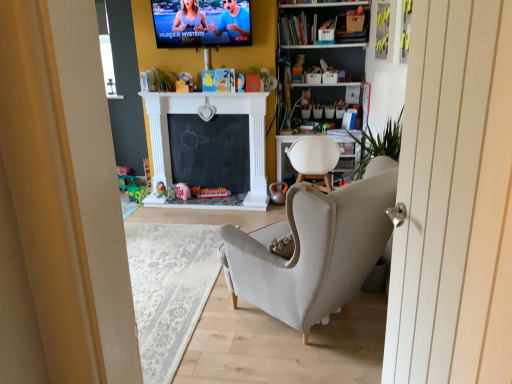
Question: Is white fabric chair at center to the left or to the right of matte pink piggy bank at center, the fourth toy viewed from the left, in the image?

Choices:
 (A) left
 (B) right

Answer: (B)

Question: From a real-world perspective, is white fabric chair at center positioned above or below matte pink piggy bank at center, the fourth toy viewed from the left?

Choices:
 (A) above
 (B) below

Answer: (A)

Question: Which of these objects is positioned farthest from the pink fabric toy at center, arranged as the 3th toy when viewed from the right?

Choices:
 (A) matte pink piggy bank at center, the fourth toy viewed from the left
 (B) translucent plastic toy at center, the 4th toy positioned from the right
 (C) metallic silver toy at center, which is counted as the 1th toy, starting from the right
 (D) matte plastic tv at upper center
 (E) green plastic toy at lower left, which is counted as the 5th toy, starting from the right

Answer: (D)

Question: Estimate the real-world distances between objects in this image. Which object is farther from the matte plastic tv at upper center?

Choices:
 (A) metallic silver toy at center, which is counted as the 1th toy, starting from the right
 (B) matte pink piggy bank at center, the second toy in the right-to-left sequence
 (C) white fabric chair at center
 (D) translucent plastic toy at center, which is counted as the 2th toy, starting from the left
 (E) pink fabric toy at center, arranged as the 3th toy when viewed from the right

Answer: (A)